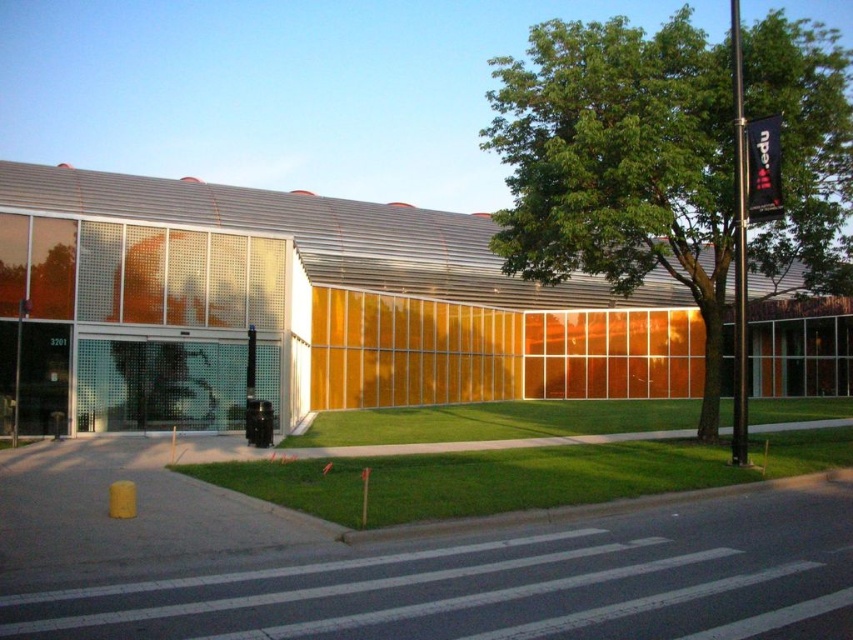
You are a city planner assessing the building design. The green leafy tree at upper right and the black matte traffic light at center are both visible from the main entrance. Which object is taller?

The green leafy tree at upper right is much taller than the black matte traffic light at center.

You are a pedestrian standing at the entrance of the modern building and want to locate both the green leafy tree at upper right and the black matte traffic light at center. Which object is positioned higher in the scene?

The green leafy tree at upper right is positioned higher than the black matte traffic light at center.

Looking at this image, you are a visitor approaching the modern building and notice the green leafy tree at upper right and the green grass at lower center. From your perspective, which object is positioned to the right side?

The green leafy tree at upper right is positioned to the right of the green grass at lower center.